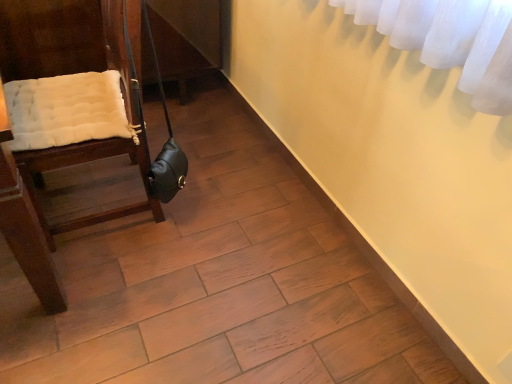
Question: Does point (178, 178) appear closer or farther from the camera than point (108, 39)?

Choices:
 (A) farther
 (B) closer

Answer: (A)

Question: In terms of height, does leather-like black bag at lower left look taller or shorter compared to wooden chair with cushion at left?

Choices:
 (A) short
 (B) tall

Answer: (A)

Question: Based on their positions, is leather-like black bag at lower left located to the left or right of wooden chair with cushion at left?

Choices:
 (A) left
 (B) right

Answer: (B)

Question: Visually, is wooden chair with cushion at left positioned to the left or to the right of leather-like black bag at lower left?

Choices:
 (A) left
 (B) right

Answer: (A)

Question: From the image's perspective, relative to leather-like black bag at lower left, is wooden chair with cushion at left above or below?

Choices:
 (A) above
 (B) below

Answer: (A)

Question: Considering the positions of point (42, 11) and point (163, 162), is point (42, 11) closer or farther from the camera than point (163, 162)?

Choices:
 (A) farther
 (B) closer

Answer: (A)

Question: Looking at the image, does wooden chair with cushion at left seem bigger or smaller compared to leather-like black bag at lower left?

Choices:
 (A) big
 (B) small

Answer: (A)